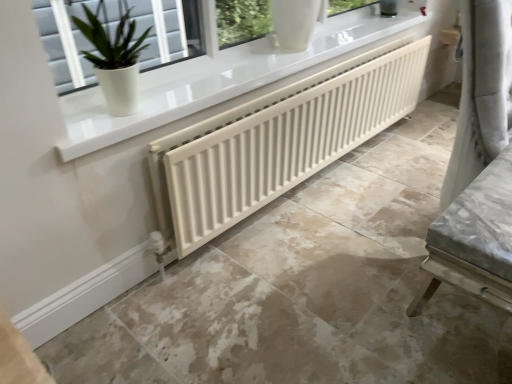
Question: Considering the relative positions of white matte radiator at center and white matte radiator at center in the image provided, is white matte radiator at center in front of white matte radiator at center?

Choices:
 (A) yes
 (B) no

Answer: (A)

Question: Is white matte radiator at center thinner than white matte radiator at center?

Choices:
 (A) yes
 (B) no

Answer: (B)

Question: Does white matte radiator at center come behind white matte radiator at center?

Choices:
 (A) yes
 (B) no

Answer: (B)

Question: Can you confirm if white matte radiator at center is smaller than white matte radiator at center?

Choices:
 (A) no
 (B) yes

Answer: (A)

Question: Is white matte radiator at center beside white matte radiator at center?

Choices:
 (A) yes
 (B) no

Answer: (B)

Question: Could you tell me if white matte radiator at center is turned towards white matte radiator at center?

Choices:
 (A) yes
 (B) no

Answer: (B)

Question: Considering the relative sizes of white matte radiator at center and white matte radiator at center in the image provided, is white matte radiator at center thinner than white matte radiator at center?

Choices:
 (A) yes
 (B) no

Answer: (A)

Question: Would you say white matte radiator at center contains white matte radiator at center?

Choices:
 (A) no
 (B) yes

Answer: (A)

Question: Does white matte radiator at center come behind white matte radiator at center?

Choices:
 (A) yes
 (B) no

Answer: (A)

Question: Is white matte radiator at center not close to white matte radiator at center?

Choices:
 (A) yes
 (B) no

Answer: (B)

Question: Considering the relative sizes of white matte radiator at center and white matte radiator at center in the image provided, is white matte radiator at center smaller than white matte radiator at center?

Choices:
 (A) no
 (B) yes

Answer: (B)

Question: Considering the relative sizes of white matte radiator at center and white matte radiator at center in the image provided, is white matte radiator at center wider than white matte radiator at center?

Choices:
 (A) yes
 (B) no

Answer: (B)

Question: Does white matte radiator at center have a lesser width compared to white glossy pot at upper left?

Choices:
 (A) yes
 (B) no

Answer: (B)